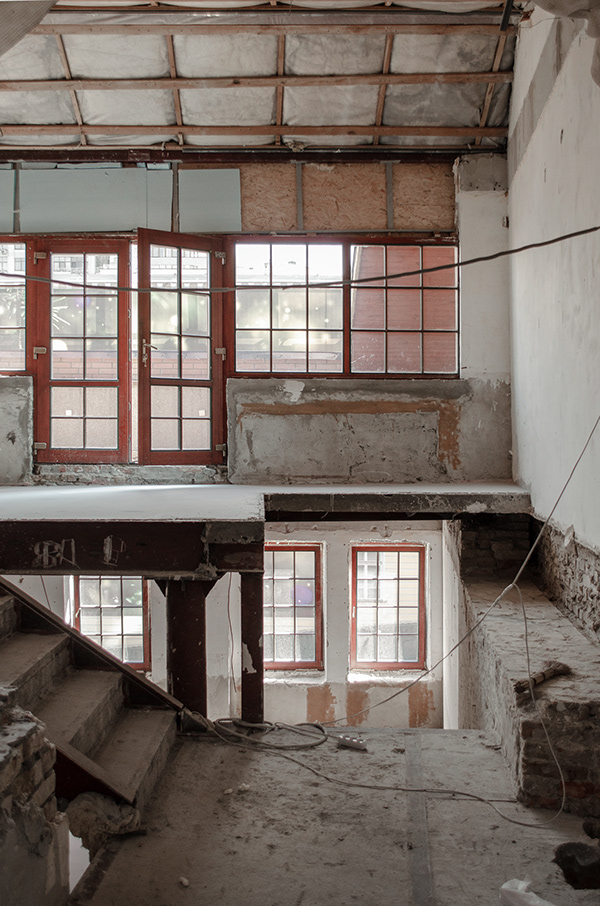
At what (x,y) coordinates should I click in order to perform the action: click on door. Please return your answer as a coordinate pair (x, y). The image size is (600, 906). Looking at the image, I should click on (174, 365), (120, 383).